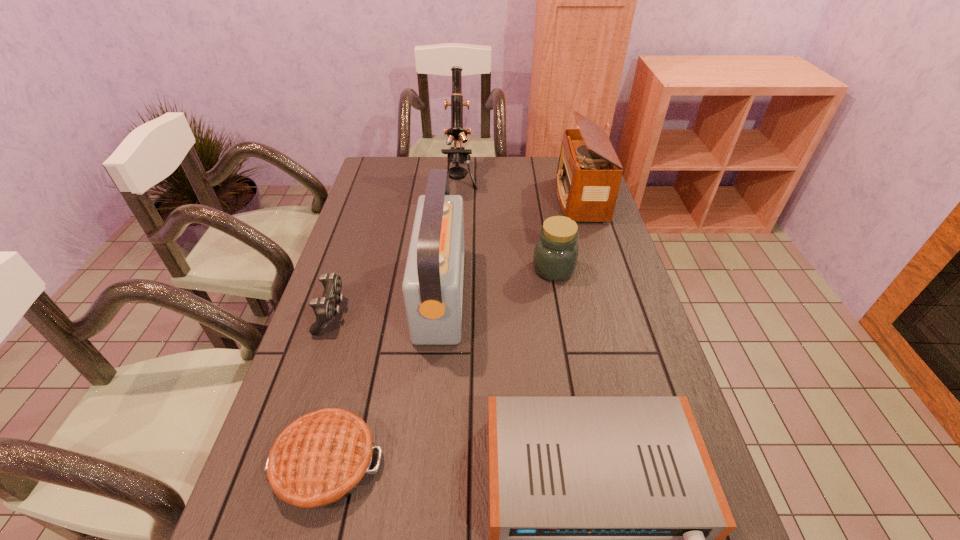
Where is `the tallest object`? Image resolution: width=960 pixels, height=540 pixels. the tallest object is located at coordinates (457, 155).

This screenshot has width=960, height=540. What are the coordinates of `the leftmost radio receiver` in the screenshot? It's located at (432, 286).

Identify the location of the farthest radio receiver. Image resolution: width=960 pixels, height=540 pixels. (589, 173).

Find the location of a particular element. the fourth shortest object is located at coordinates (556, 251).

The height and width of the screenshot is (540, 960). In order to click on control in this screenshot , I will do `click(325, 308)`.

Locate an element on the screen. Image resolution: width=960 pixels, height=540 pixels. the shortest object is located at coordinates (318, 460).

The height and width of the screenshot is (540, 960). In order to click on vacant space positioned 0.250m through the eyepiece of the tallest object in this screenshot , I will do `click(454, 246)`.

Image resolution: width=960 pixels, height=540 pixels. Identify the location of free space located 0.370m on the front-facing side of the second nearest radio receiver. (595, 293).

Identify the location of free space located on the front panel of the farthest radio receiver. click(451, 199).

Where is `free space located 0.230m on the front panel of the farthest radio receiver`? The image size is (960, 540). free space located 0.230m on the front panel of the farthest radio receiver is located at coordinates (493, 199).